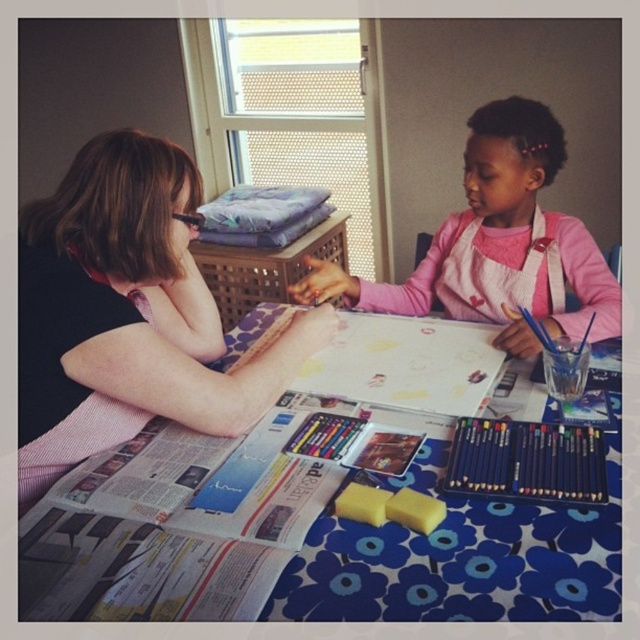
Which is behind, point (202, 544) or point (33, 356)?

Point (33, 356)

Between blue floral tablecloth at center and blonde hair at upper left, which one is positioned lower?

blue floral tablecloth at center is below.

Who is more forward, (188, 593) or (44, 474)?

Point (188, 593)

Where is `blue floral tablecloth at center`? The height and width of the screenshot is (640, 640). blue floral tablecloth at center is located at coordinates pyautogui.click(x=307, y=544).

Can you confirm if blue floral tablecloth at center is positioned to the right of pink fabric apron at upper right?

No, blue floral tablecloth at center is not to the right of pink fabric apron at upper right.

The image size is (640, 640). I want to click on blue floral tablecloth at center, so click(x=307, y=544).

Where is `blue floral tablecloth at center`? Image resolution: width=640 pixels, height=640 pixels. blue floral tablecloth at center is located at coordinates (307, 544).

Is blue floral tablecloth at center in front of matte black pencils at lower right?

That is True.

In order to click on blue floral tablecloth at center in this screenshot , I will do `click(307, 544)`.

I want to click on blue floral tablecloth at center, so click(x=307, y=544).